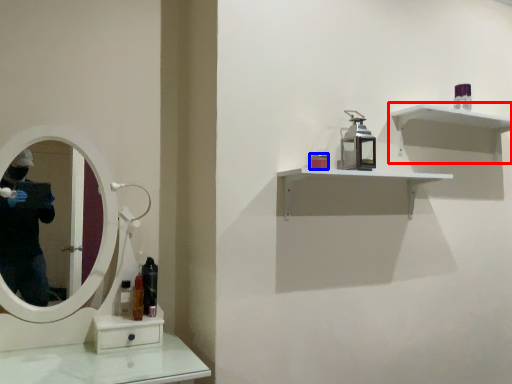
Question: Which object is further to the camera taking this photo, shelf (highlighted by a red box) or toiletry (highlighted by a blue box)?

Choices:
 (A) shelf
 (B) toiletry

Answer: (A)